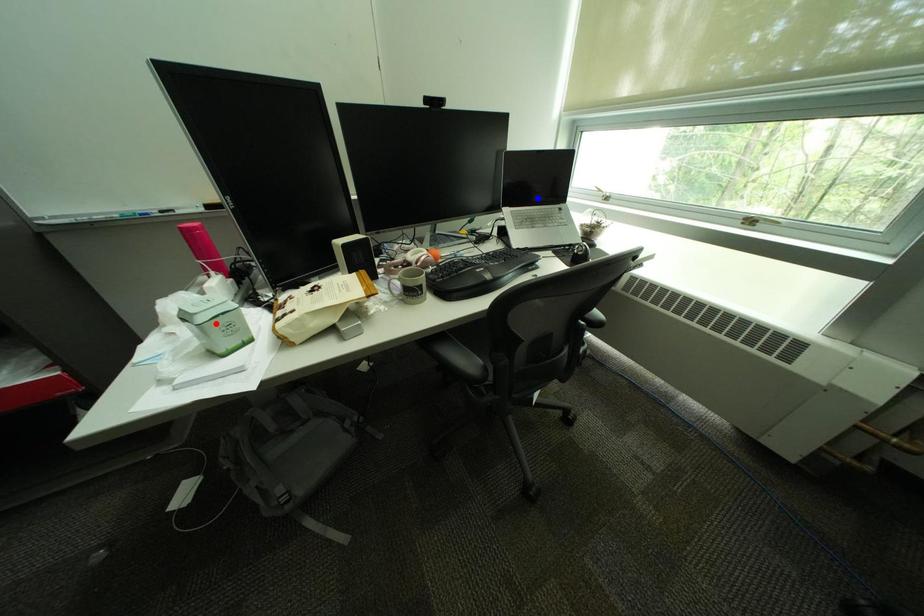
Question: Which of the two points in the image is closer to the camera?

Choices:
 (A) Blue point is closer.
 (B) Red point is closer.

Answer: (B)